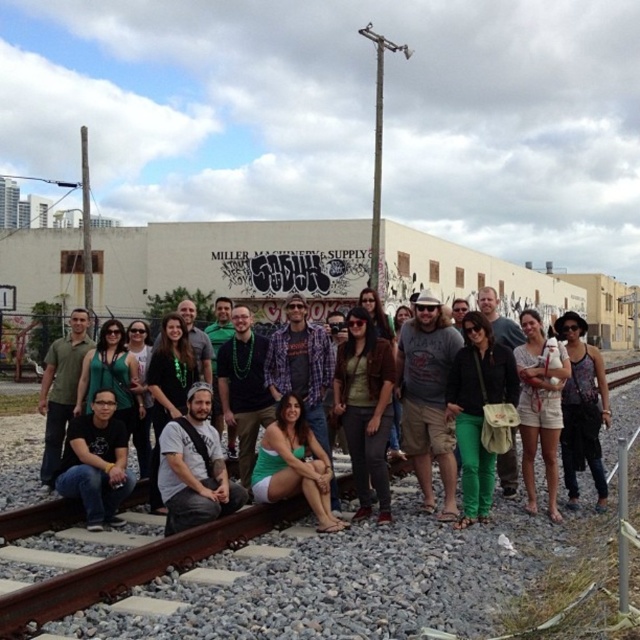
Question: Is green denim shorts at center below green matte shirt at center?

Choices:
 (A) yes
 (B) no

Answer: (B)

Question: Which object is farther from the camera taking this photo?

Choices:
 (A) rusty metal train track at center
 (B) green denim shorts at center
 (C) green matte shirt at center

Answer: (B)

Question: Which of these objects is positioned closest to the black matte shirt at lower left?

Choices:
 (A) matte black tank top at center
 (B) rusty metal train track at center

Answer: (B)

Question: Is green denim shorts at center bigger than green matte shirt at center?

Choices:
 (A) yes
 (B) no

Answer: (A)

Question: Is matte black tank top at center positioned in front of green denim shorts at center?

Choices:
 (A) no
 (B) yes

Answer: (A)

Question: Considering the real-world distances, which object is farthest from the matte green pants at center?

Choices:
 (A) green matte shirt at center
 (B) green fabric dress at center
 (C) black matte shirt at lower left
 (D) matte black tank top at center

Answer: (C)